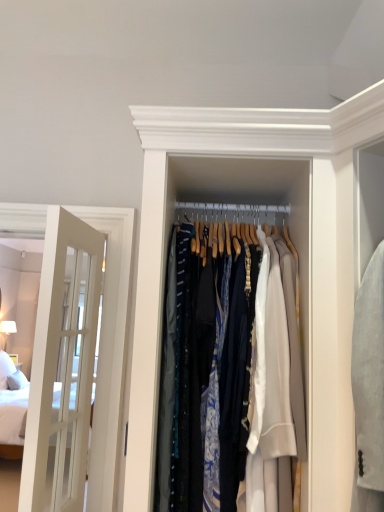
Question: From a real-world perspective, does white glass door at left sit lower than silky fabric clothes at center?

Choices:
 (A) no
 (B) yes

Answer: (B)

Question: Does white glass door at left have a lesser height compared to silky fabric clothes at center?

Choices:
 (A) no
 (B) yes

Answer: (A)

Question: Is silky fabric clothes at center a part of white glass door at left?

Choices:
 (A) yes
 (B) no

Answer: (B)

Question: Is the position of white glass door at left less distant than that of silky fabric clothes at center?

Choices:
 (A) yes
 (B) no

Answer: (B)

Question: From a real-world perspective, is white glass door at left positioned over silky fabric clothes at center based on gravity?

Choices:
 (A) yes
 (B) no

Answer: (B)

Question: Can you confirm if white glass door at left is bigger than silky fabric clothes at center?

Choices:
 (A) yes
 (B) no

Answer: (B)

Question: Does silky fabric clothes at center have a greater height compared to white glass door at left?

Choices:
 (A) yes
 (B) no

Answer: (B)

Question: Does silky fabric clothes at center turn towards white glass door at left?

Choices:
 (A) yes
 (B) no

Answer: (B)

Question: Is silky fabric clothes at center oriented away from white glass door at left?

Choices:
 (A) yes
 (B) no

Answer: (B)

Question: Does silky fabric clothes at center contain white glass door at left?

Choices:
 (A) yes
 (B) no

Answer: (B)

Question: From a real-world perspective, is silky fabric clothes at center located higher than white glass door at left?

Choices:
 (A) yes
 (B) no

Answer: (A)

Question: From the image's perspective, does silky fabric clothes at center appear lower than white glass door at left?

Choices:
 (A) yes
 (B) no

Answer: (B)

Question: From a real-world perspective, is silky fabric clothes at center physically located above or below white glass door at left?

Choices:
 (A) above
 (B) below

Answer: (A)